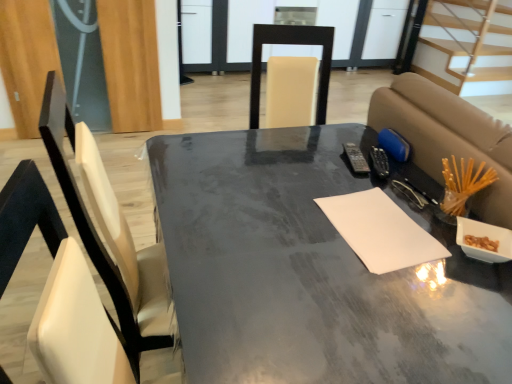
Locate an element on the screen. vacant area on top of matte gray table at center (from a real-world perspective) is located at coordinates (308, 250).